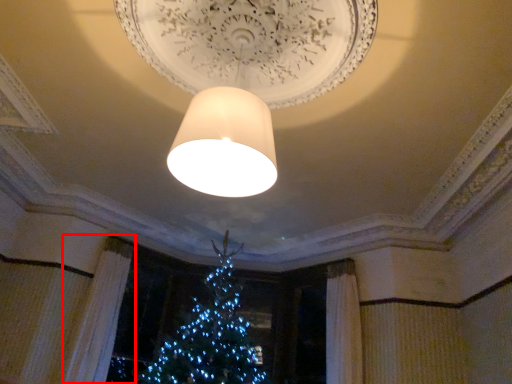
Question: From the image's perspective, where is curtain (annotated by the red box) located relative to lamp?

Choices:
 (A) below
 (B) above

Answer: (A)